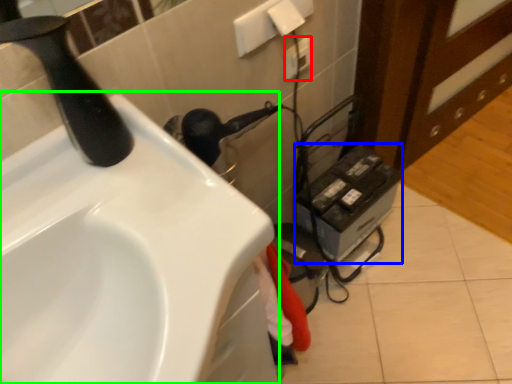
Question: Which is farther away from electric outlet (highlighted by a red box)? appliance (highlighted by a blue box) or sink (highlighted by a green box)?

Choices:
 (A) appliance
 (B) sink

Answer: (B)